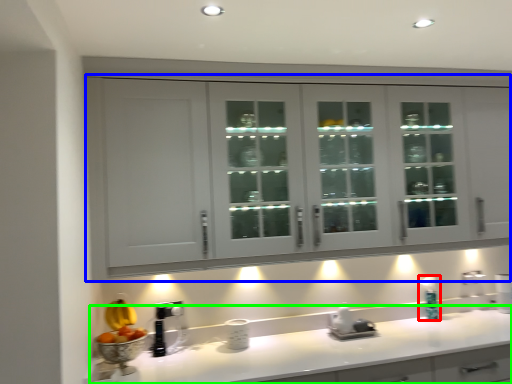
Question: Estimate the real-world distances between objects in this image. Which object is closer to soap dispenser (highlighted by a red box), cabinetry (highlighted by a blue box) or countertop (highlighted by a green box)?

Choices:
 (A) cabinetry
 (B) countertop

Answer: (B)